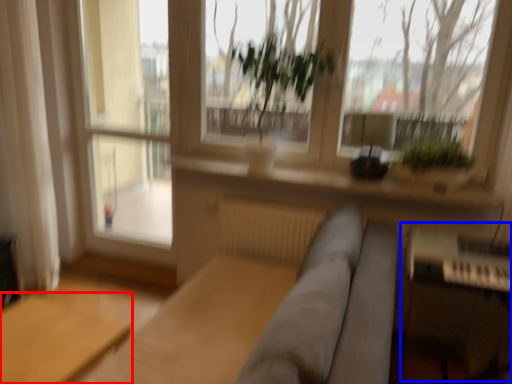
Question: Which of the following is the farthest to the observer, table (highlighted by a red box) or piano (highlighted by a blue box)?

Choices:
 (A) table
 (B) piano

Answer: (B)